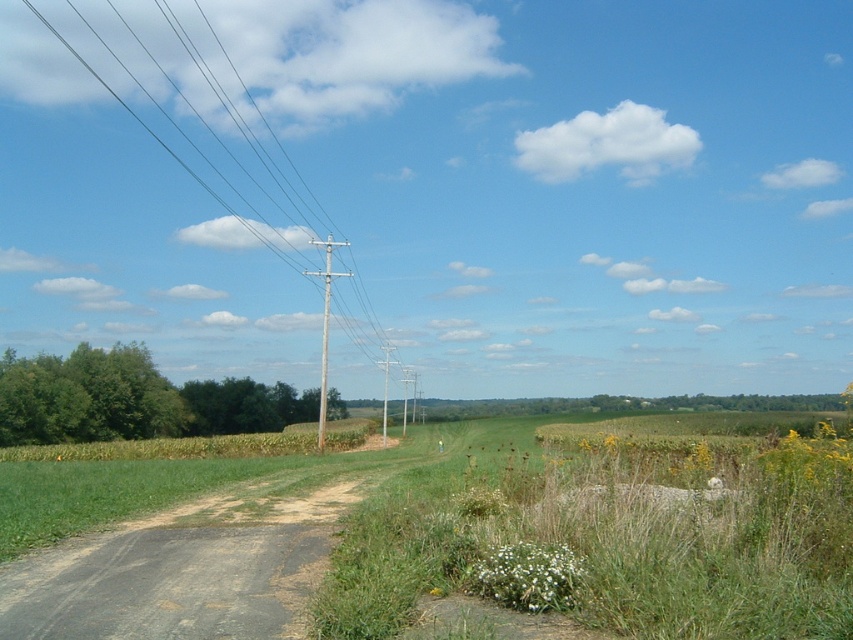
You are a bird trying to land on the metallic wire at upper left and the brown wooden telegraph pole at center. Which one has a wider surface for your landing?

The metallic wire at upper left has a larger width than the brown wooden telegraph pole at center, so it provides a wider surface for landing.

You are a painter standing on the dull gray asphalt at lower left, looking towards the brown wooden telegraph pole at center. Which object is taller when viewed from your position?

The brown wooden telegraph pole at center is taller than the dull gray asphalt at lower left.

You are a bird flying over a rural area and see the metallic wire at upper left and the brown wooden telegraph pole at center. Which object would appear bigger to you from above?

The metallic wire at upper left appears bigger than the brown wooden telegraph pole at center because it has a larger size compared to it.